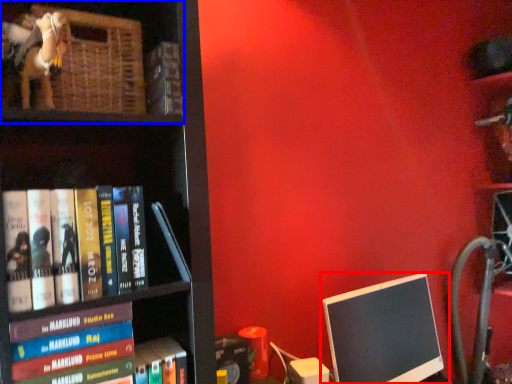
Question: Among these objects, which one is farthest to the camera, computer monitor (highlighted by a red box) or shelf (highlighted by a blue box)?

Choices:
 (A) computer monitor
 (B) shelf

Answer: (A)